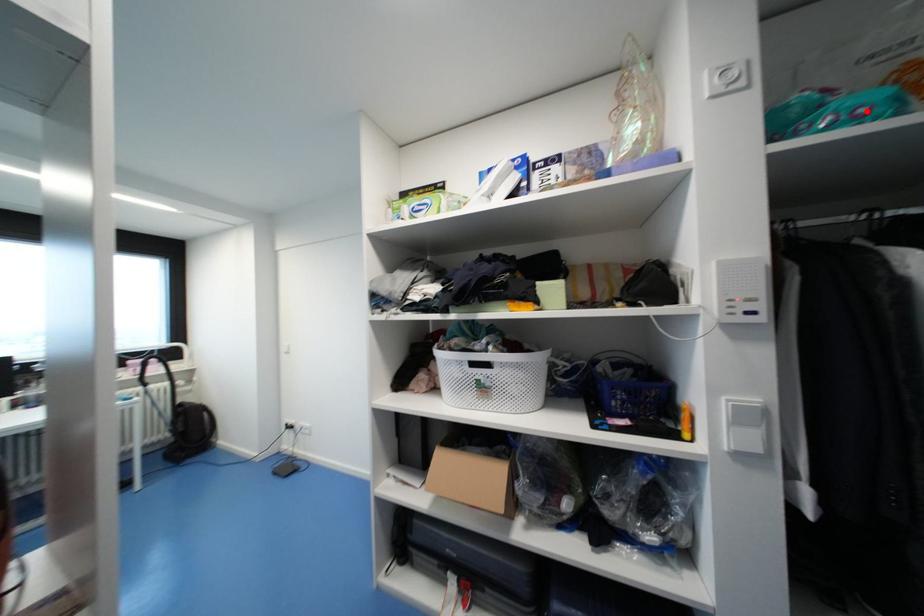
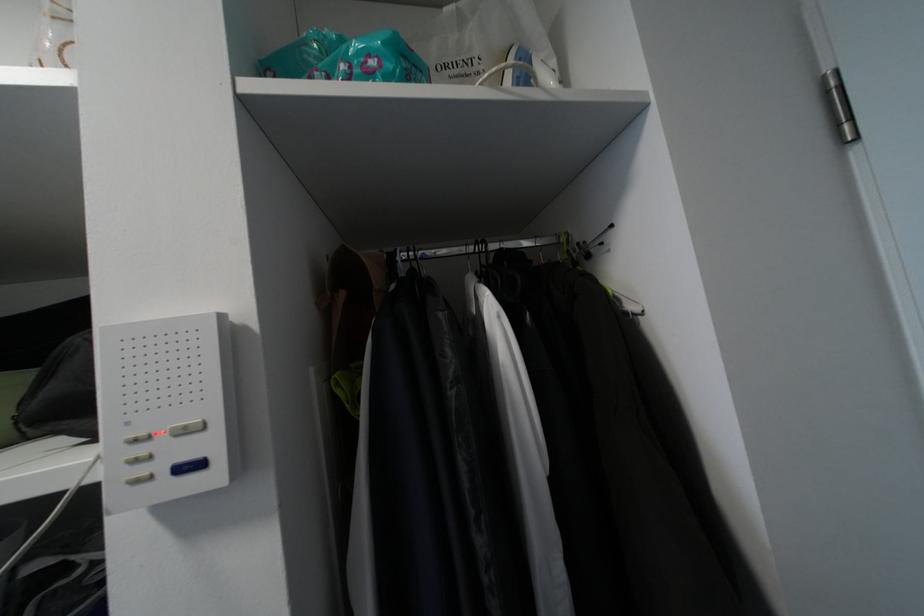
Locate, in the second image, the point that corresponds to the highlighted location in the first image.

(377, 63)